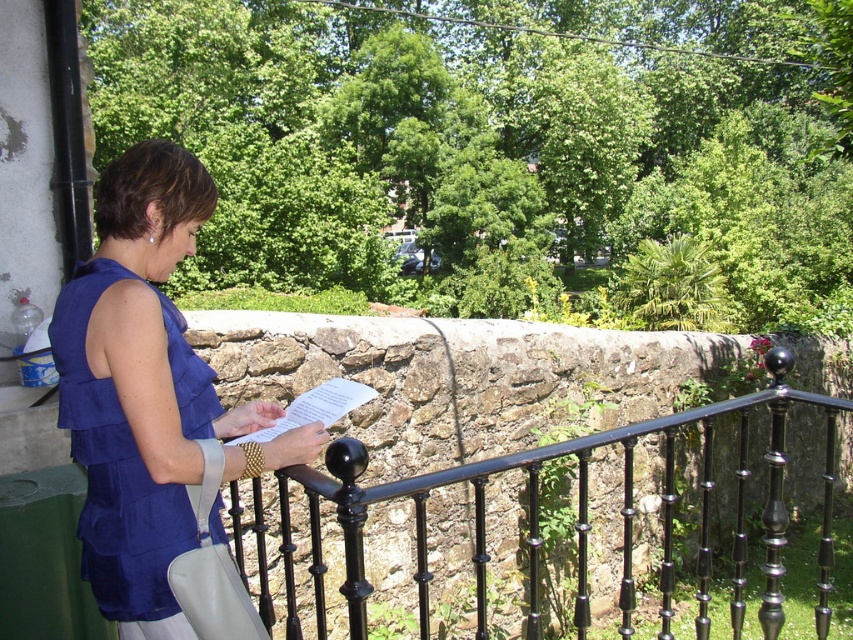
Does black wrought iron railing at center appear under matte blue blouse at center?

Correct, black wrought iron railing at center is located below matte blue blouse at center.

Which is more to the right, black wrought iron railing at center or matte blue blouse at center?

From the viewer's perspective, black wrought iron railing at center appears more on the right side.

Does point (498, 570) come in front of point (119, 552)?

That is False.

At what (x,y) coordinates should I click in order to perform the action: click on black wrought iron railing at center. Please return your answer as a coordinate pair (x, y). Looking at the image, I should click on click(561, 525).